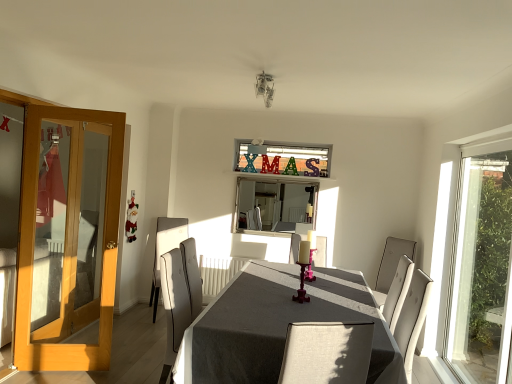
Question: Does light brown wooden door at left have a greater width compared to light gray fabric chair at center, the second chair in the right-to-left sequence?

Choices:
 (A) yes
 (B) no

Answer: (B)

Question: Is light gray fabric chair at center, the second chair in the right-to-left sequence, completely or partially inside light brown wooden door at left?

Choices:
 (A) no
 (B) yes

Answer: (A)

Question: Is light brown wooden door at left far away from light gray fabric chair at center, the second chair in the right-to-left sequence?

Choices:
 (A) yes
 (B) no

Answer: (A)

Question: Can you confirm if light brown wooden door at left is taller than light gray fabric chair at center, the 1th chair positioned from the left?

Choices:
 (A) no
 (B) yes

Answer: (B)

Question: Is light brown wooden door at left at the right side of light gray fabric chair at center, the 1th chair positioned from the left?

Choices:
 (A) no
 (B) yes

Answer: (A)

Question: Considering the positions of light brown wooden door at left and light gray fabric chair at center, the 1th chair positioned from the left, in the image, is light brown wooden door at left wider or thinner than light gray fabric chair at center, the 1th chair positioned from the left,?

Choices:
 (A) thin
 (B) wide

Answer: (A)

Question: Relative to light gray fabric chair at center, the 1th chair positioned from the left, is light brown wooden door at left in front or behind?

Choices:
 (A) behind
 (B) front

Answer: (B)

Question: From their relative heights in the image, would you say light brown wooden door at left is taller or shorter than light gray fabric chair at center, the second chair in the right-to-left sequence?

Choices:
 (A) short
 (B) tall

Answer: (B)

Question: Is light brown wooden door at left inside the boundaries of light gray fabric chair at center, the second chair in the right-to-left sequence, or outside?

Choices:
 (A) outside
 (B) inside

Answer: (A)

Question: In terms of height, does white fabric chair at right, the 1th chair when ordered from right to left, look taller or shorter compared to pink glossy candle holder at center?

Choices:
 (A) tall
 (B) short

Answer: (A)

Question: From the image's perspective, is white fabric chair at right, which is counted as the second chair, starting from the left, above or below pink glossy candle holder at center?

Choices:
 (A) above
 (B) below

Answer: (B)

Question: Is white fabric chair at right, the 1th chair when ordered from right to left, wider or thinner than pink glossy candle holder at center?

Choices:
 (A) thin
 (B) wide

Answer: (B)

Question: Is white fabric chair at right, the 1th chair when ordered from right to left, bigger or smaller than pink glossy candle holder at center?

Choices:
 (A) small
 (B) big

Answer: (B)

Question: In terms of size, does gray fabric table at center appear bigger or smaller than light gray fabric chair at center, the second chair in the right-to-left sequence?

Choices:
 (A) small
 (B) big

Answer: (B)

Question: Is gray fabric table at center inside or outside of light gray fabric chair at center, the second chair in the right-to-left sequence?

Choices:
 (A) inside
 (B) outside

Answer: (B)